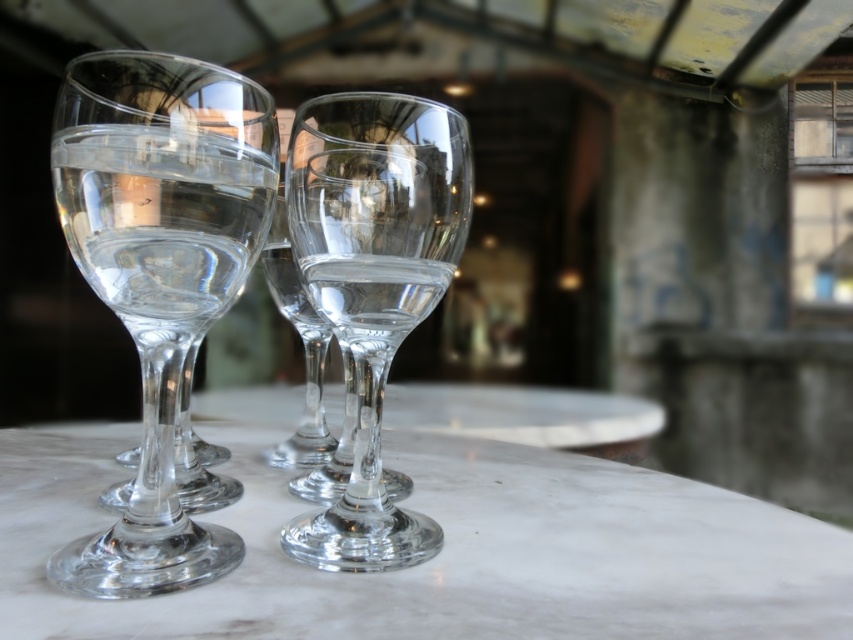
You are a waiter carrying a tray of drinks and need to place them on the table between the two points marked as point (480, 579). Can you fit the tray between them if your tray is 10 inches wide?

The distance between the two points marked as point (480, 579) is 9.74 inches, so yes, the tray can fit between them since it is slightly narrower than the tray width.

You are a bartender preparing drinks for a party. You have two wine glasses in front of you on the table. One is the transparent glass wine glass at left and the other is the transparent glass wine glass at center. Which glass should you choose if you want to serve a drink that requires a taller glass?

You should choose the transparent glass wine glass at left because it is taller than the transparent glass wine glass at center.

You are a photographer setting up for a shoot and need to place a small decorative item exactly at the center of the image. The transparent glass wine glass at left is currently at point 0.425, 0.188. Is the glass positioned to the left or right of the center?

The transparent glass wine glass at left is positioned to the left of the center because its coordinates are at (160, 272), which places it left of the center point at 0.5 on the x axis.